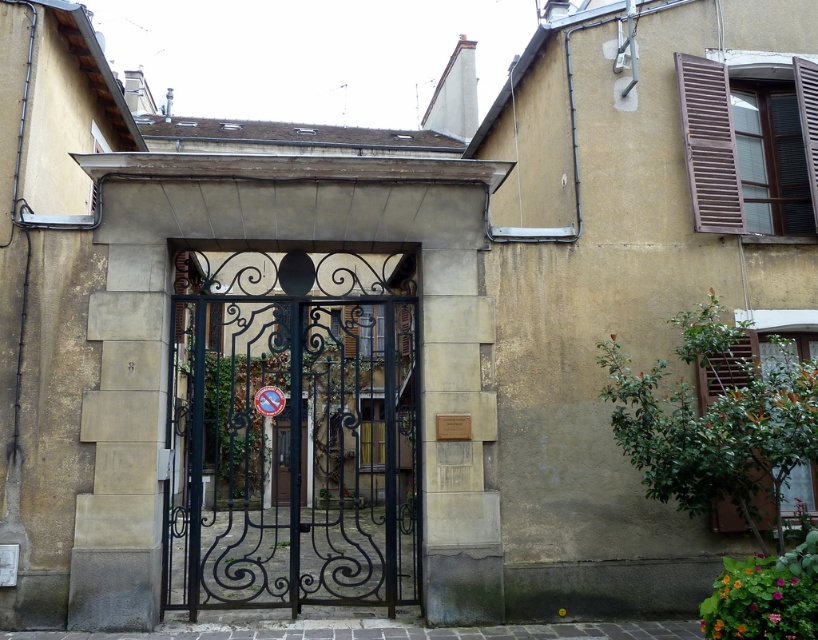
Is black wrought iron gate at center taller than brown wooden shutters at upper right?

Yes.

Can you confirm if black wrought iron gate at center is positioned below brown wooden shutters at upper right?

Yes, black wrought iron gate at center is below brown wooden shutters at upper right.

Image resolution: width=818 pixels, height=640 pixels. What do you see at coordinates (291, 433) in the screenshot?
I see `black wrought iron gate at center` at bounding box center [291, 433].

I want to click on black wrought iron gate at center, so click(x=291, y=433).